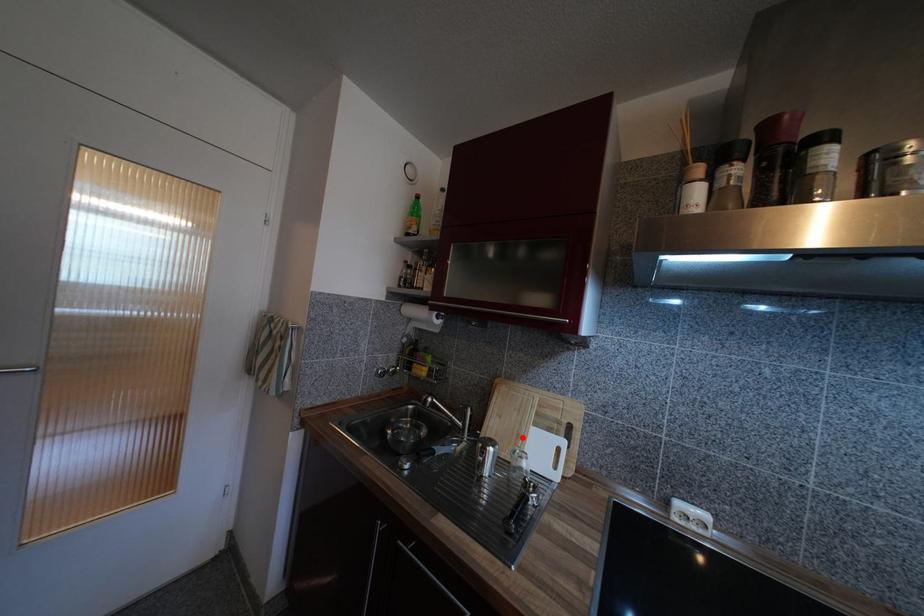
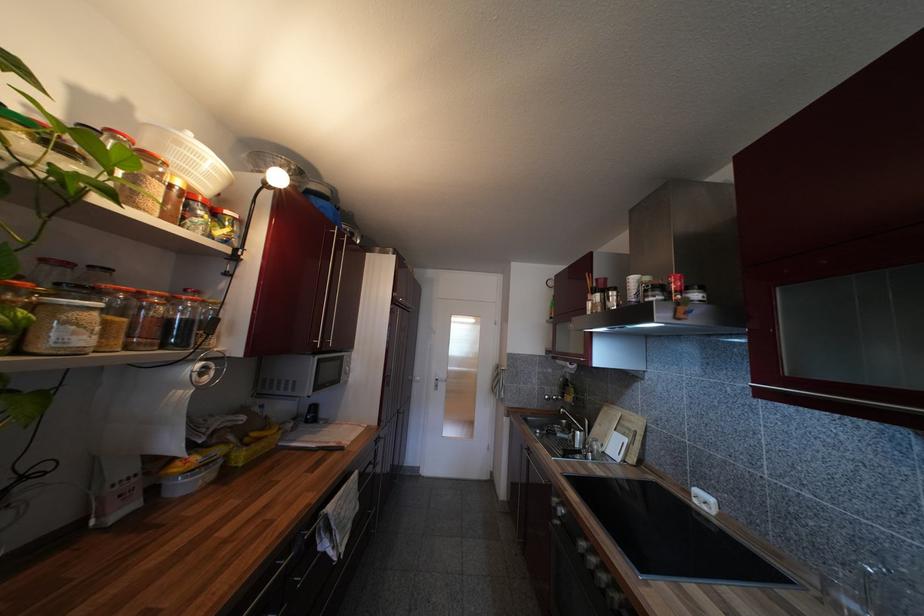
In the second image, find the point that corresponds to the highlighted location in the first image.

(610, 438)